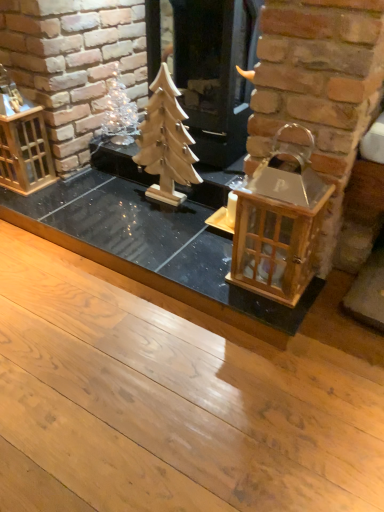
This screenshot has height=512, width=384. Find the location of `free space that is to the left of wooden lantern at right`. free space that is to the left of wooden lantern at right is located at coordinates (210, 275).